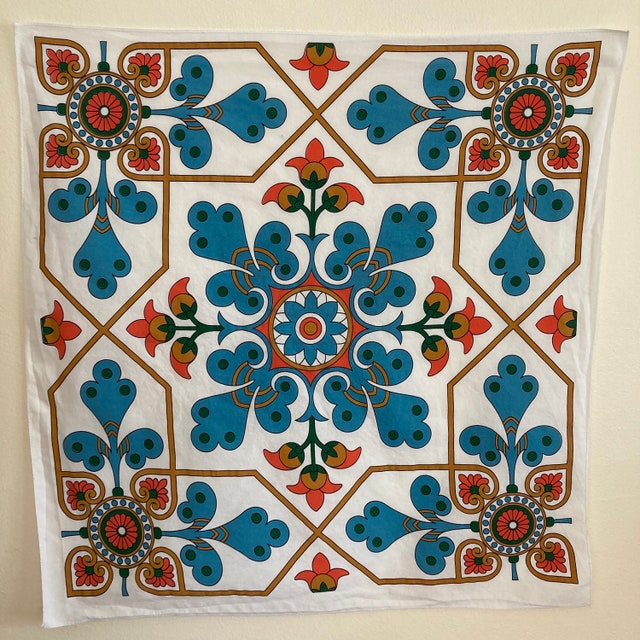
What are the coordinates of `wall` in the screenshot? It's located at (612, 541).